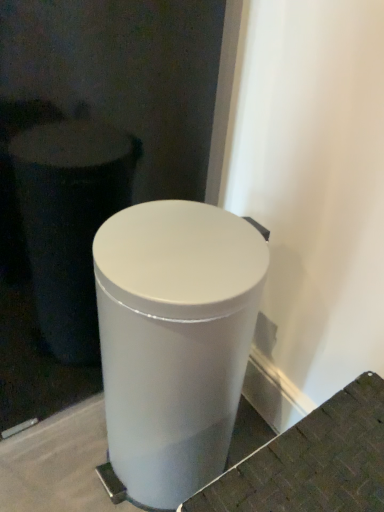
Question: Considering the positions of white glossy trash can at center and white matte trash can at center in the image, is white glossy trash can at center wider or thinner than white matte trash can at center?

Choices:
 (A) thin
 (B) wide

Answer: (A)

Question: From a real-world perspective, is white glossy trash can at center positioned above or below white matte trash can at center?

Choices:
 (A) above
 (B) below

Answer: (A)

Question: Is white glossy trash can at center situated inside white matte trash can at center or outside?

Choices:
 (A) inside
 (B) outside

Answer: (B)

Question: Is white matte trash can at center bigger or smaller than white glossy trash can at center?

Choices:
 (A) big
 (B) small

Answer: (B)

Question: From the image's perspective, is white matte trash can at center located above or below white glossy trash can at center?

Choices:
 (A) below
 (B) above

Answer: (A)

Question: From a real-world perspective, relative to white glossy trash can at center, is white matte trash can at center vertically above or below?

Choices:
 (A) above
 (B) below

Answer: (B)

Question: Is white matte trash can at center situated inside white glossy trash can at center or outside?

Choices:
 (A) inside
 (B) outside

Answer: (B)